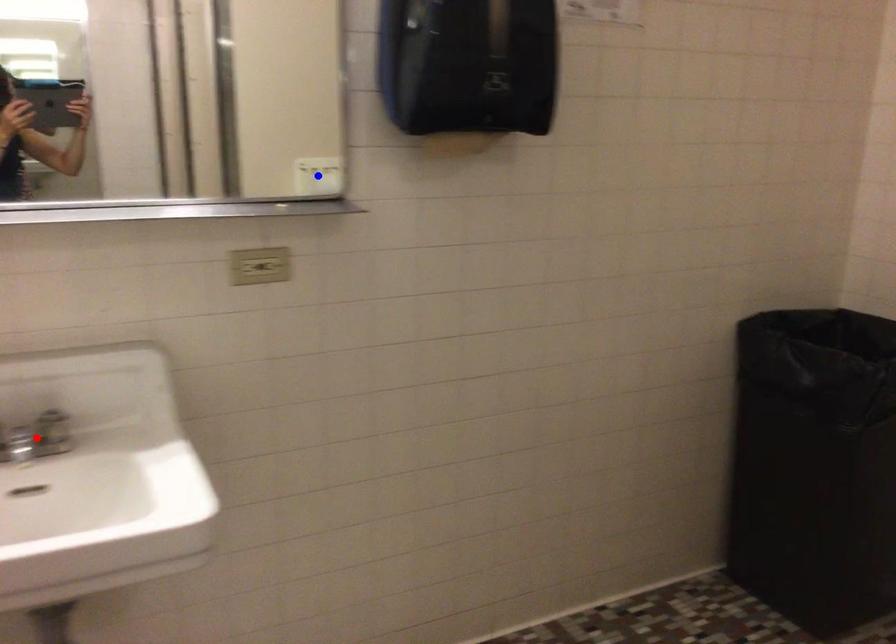
Question: In the image, two points are highlighted. Which point is nearer to the camera? Reply with the corresponding letter.

Choices:
 (A) blue point
 (B) red point

Answer: (B)